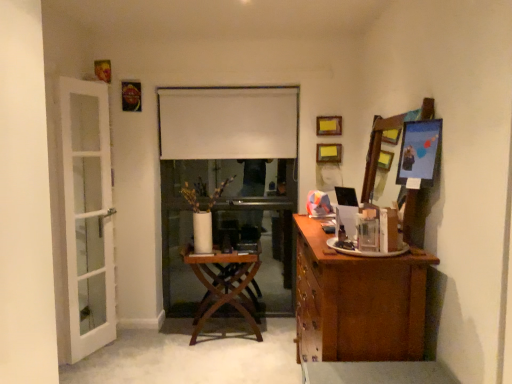
At what (x,y) coordinates should I click in order to perform the action: click on free space in front of wooden table at center. Please return your answer as a coordinate pair (x, y). This screenshot has width=512, height=384. Looking at the image, I should click on (214, 358).